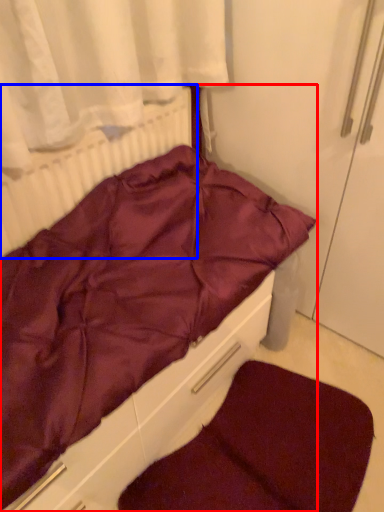
Question: Which object appears farthest to the camera in this image, furniture (highlighted by a red box) or radiator (highlighted by a blue box)?

Choices:
 (A) furniture
 (B) radiator

Answer: (B)